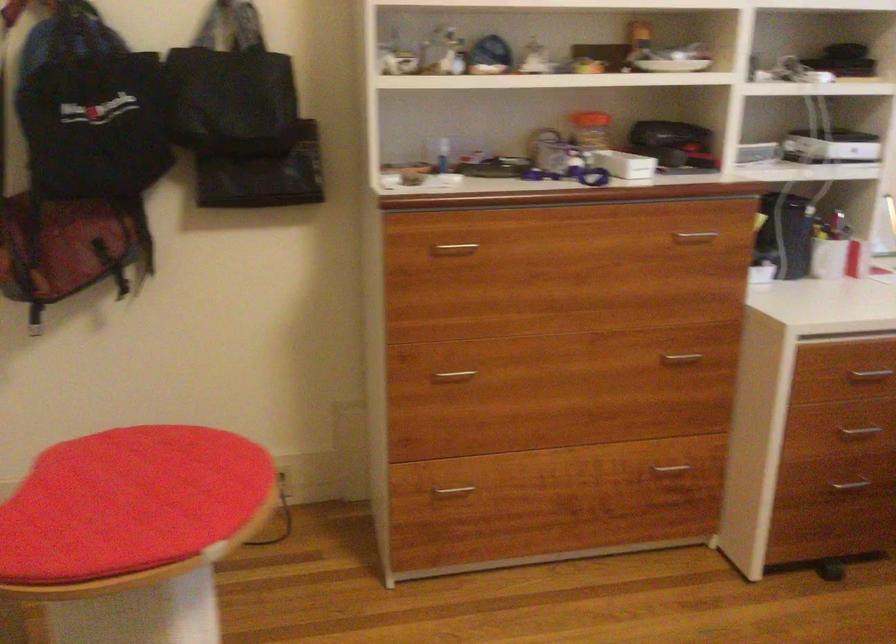
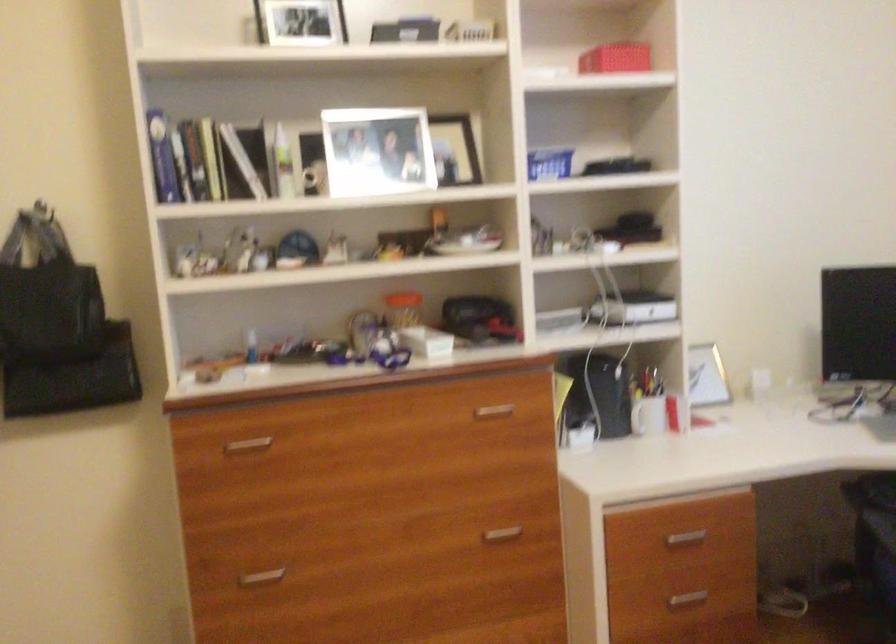
The point at [452,245] is marked in the first image. Where is the corresponding point in the second image?

(247, 444)